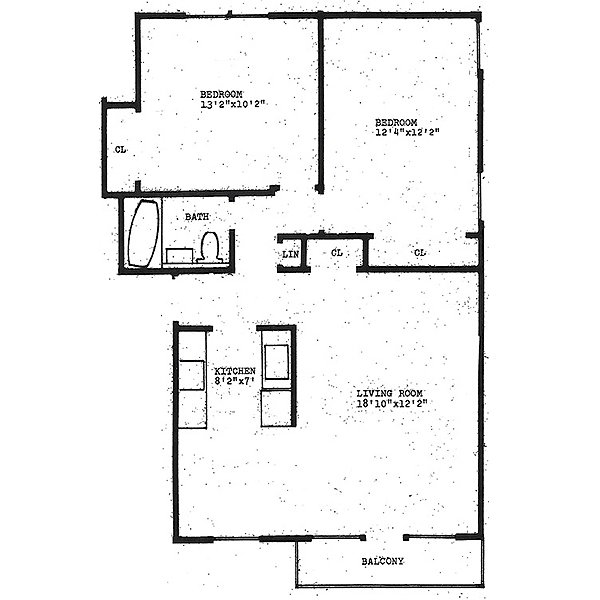
Where is `living room`? The width and height of the screenshot is (600, 600). living room is located at coordinates (401, 394).